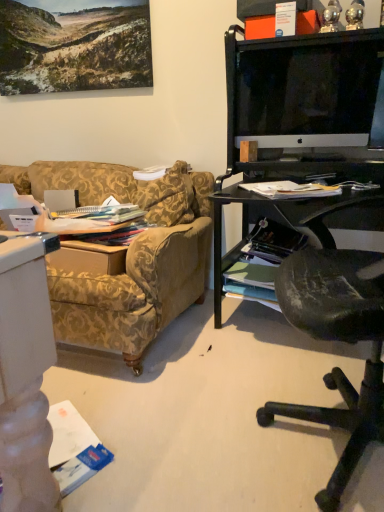
Find the location of `vacant area situated below white paper magazine at right, arranged as the 2th magazine when ordered from the bottom (from a real-world perspective)`. vacant area situated below white paper magazine at right, arranged as the 2th magazine when ordered from the bottom (from a real-world perspective) is located at coordinates (297, 345).